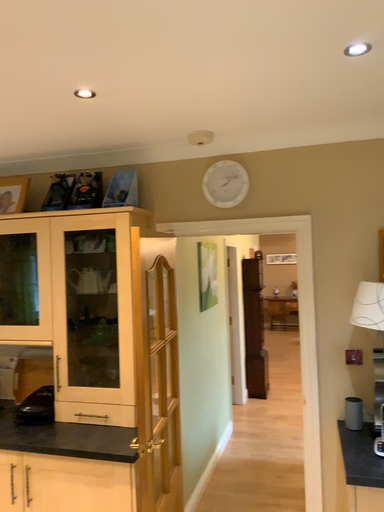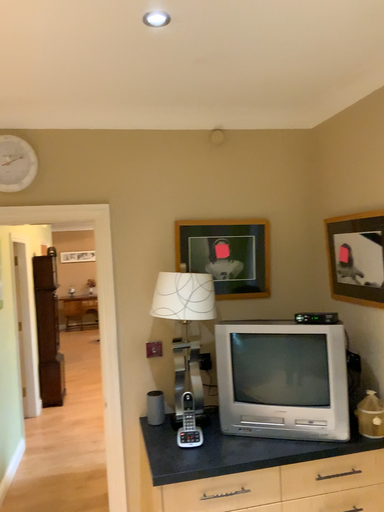
Question: Which way did the camera rotate in the video?

Choices:
 (A) rotated right
 (B) rotated left

Answer: (A)